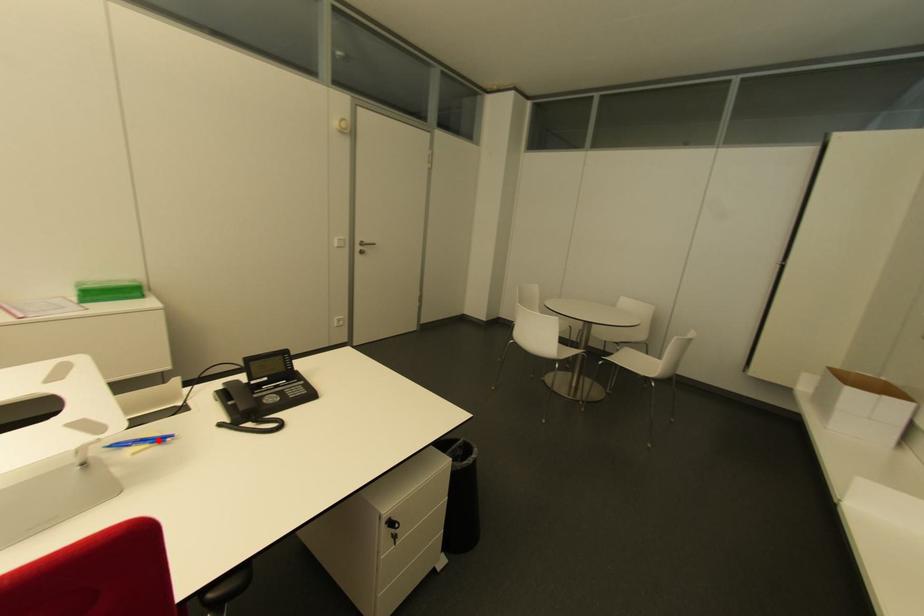
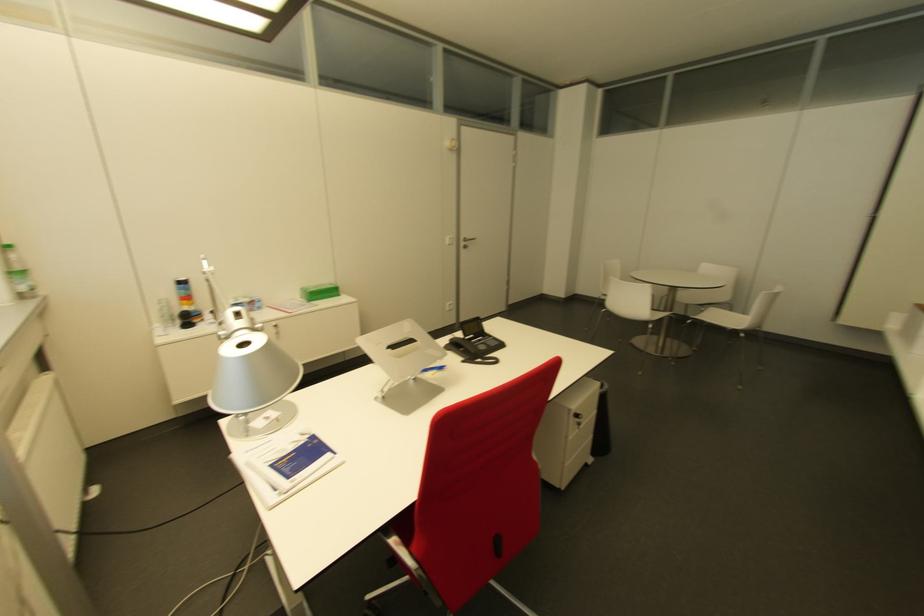
Where in the second image is the point corresponding to the highlighted location from the first image?

(439, 369)